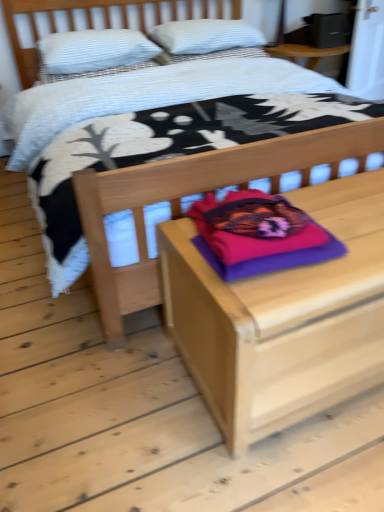
Where is `free location in front of purple soft pillow at center, the first pillow viewed from the front`? free location in front of purple soft pillow at center, the first pillow viewed from the front is located at coordinates (283, 290).